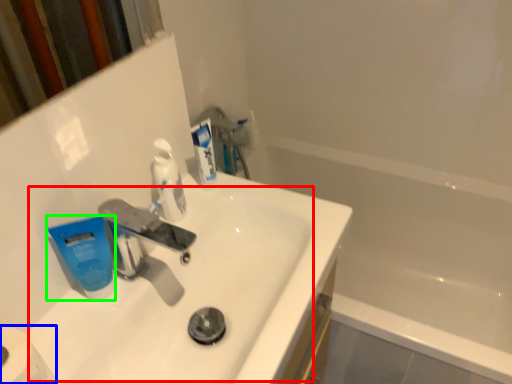
Question: Which is farther away from sink (highlighted by a red box)? toilet paper (highlighted by a blue box) or toothpaste (highlighted by a green box)?

Choices:
 (A) toilet paper
 (B) toothpaste

Answer: (A)